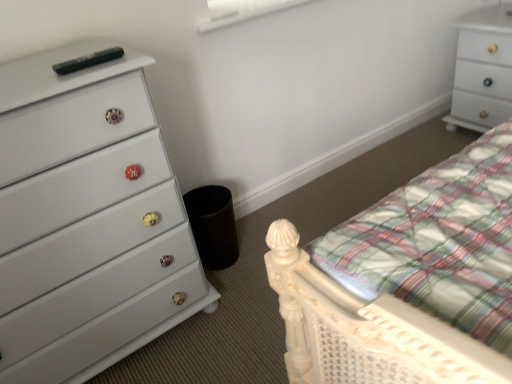
Question: Looking at their shapes, would you say white matte window screen at upper center is wider or thinner than white glossy chest of drawers at upper right, which ranks as the second chest of drawers in bottom-to-top order?

Choices:
 (A) thin
 (B) wide

Answer: (A)

Question: Considering the relative positions of white matte window screen at upper center and white glossy chest of drawers at upper right, which ranks as the second chest of drawers in bottom-to-top order, in the image provided, is white matte window screen at upper center to the left or to the right of white glossy chest of drawers at upper right, which ranks as the second chest of drawers in bottom-to-top order,?

Choices:
 (A) right
 (B) left

Answer: (B)

Question: Which of these objects is positioned closest to the white matte window screen at upper center?

Choices:
 (A) white glossy chest of drawers at left, acting as the second chest of drawers starting from the right
 (B) white glossy chest of drawers at upper right, which is counted as the 1th chest of drawers, starting from the back

Answer: (A)

Question: Estimate the real-world distances between objects in this image. Which object is farther from the white matte window screen at upper center?

Choices:
 (A) white glossy chest of drawers at left, acting as the first chest of drawers starting from the front
 (B) white glossy chest of drawers at upper right, which ranks as the 1th chest of drawers in right-to-left order

Answer: (B)